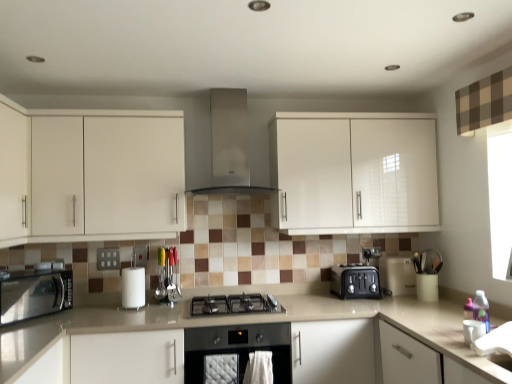
Question: Can you confirm if white glossy cabinet at upper left, the first cabinetry when ordered from left to right, is positioned to the right of black stainless steel microwave at lower left, which ranks as the second kitchen appliance in back-to-front order?

Choices:
 (A) no
 (B) yes

Answer: (B)

Question: Can you confirm if white glossy cabinet at upper left, the 2th cabinetry from the right, is bigger than black stainless steel microwave at lower left, the 1th kitchen appliance positioned from the front?

Choices:
 (A) yes
 (B) no

Answer: (A)

Question: Is the depth of white glossy cabinet at upper left, the first cabinetry when ordered from left to right, greater than that of black stainless steel microwave at lower left, the second kitchen appliance viewed from the right?

Choices:
 (A) yes
 (B) no

Answer: (A)

Question: Is white glossy cabinet at upper left, the first cabinetry when ordered from left to right, not near black stainless steel microwave at lower left, the second kitchen appliance viewed from the right?

Choices:
 (A) yes
 (B) no

Answer: (B)

Question: Would you say black stainless steel microwave at lower left, which ranks as the second kitchen appliance in back-to-front order, is part of white glossy cabinet at upper left, the 2th cabinetry from the right,'s contents?

Choices:
 (A) no
 (B) yes

Answer: (A)

Question: Would you say white glossy cabinet at upper left, the first cabinetry when ordered from left to right, is to the left or to the right of beige laminate countertop at center in the picture?

Choices:
 (A) left
 (B) right

Answer: (A)

Question: From a real-world perspective, is white glossy cabinet at upper left, the first cabinetry when ordered from left to right, positioned above or below beige laminate countertop at center?

Choices:
 (A) above
 (B) below

Answer: (A)

Question: Looking at the image, does white glossy cabinet at upper left, the first cabinetry when ordered from left to right, seem bigger or smaller compared to beige laminate countertop at center?

Choices:
 (A) big
 (B) small

Answer: (B)

Question: Is white glossy cabinet at upper left, the first cabinetry when ordered from left to right, taller or shorter than beige laminate countertop at center?

Choices:
 (A) tall
 (B) short

Answer: (A)

Question: Is black stainless steel microwave at lower left, the 1th kitchen appliance positioned from the front, in front of or behind white glossy cabinet at upper center, which is counted as the 2th cabinetry, starting from the left, in the image?

Choices:
 (A) behind
 (B) front

Answer: (B)

Question: Do you think black stainless steel microwave at lower left, the 1th kitchen appliance positioned from the front, is within white glossy cabinet at upper center, arranged as the 1th cabinetry when viewed from the right, or outside of it?

Choices:
 (A) outside
 (B) inside

Answer: (A)

Question: From their relative heights in the image, would you say black stainless steel microwave at lower left, which ranks as the 1th kitchen appliance in left-to-right order, is taller or shorter than white glossy cabinet at upper center, which is counted as the 2th cabinetry, starting from the left?

Choices:
 (A) short
 (B) tall

Answer: (A)

Question: Based on their sizes in the image, would you say black stainless steel microwave at lower left, which ranks as the 1th kitchen appliance in left-to-right order, is bigger or smaller than white glossy cabinet at upper center, arranged as the 1th cabinetry when viewed from the right?

Choices:
 (A) big
 (B) small

Answer: (B)

Question: From their relative heights in the image, would you say stainless steel oven at center, the second home appliance viewed from the top, is taller or shorter than beige laminate countertop at center?

Choices:
 (A) short
 (B) tall

Answer: (A)

Question: Considering the positions of stainless steel oven at center, the first home appliance ordered from the bottom, and beige laminate countertop at center in the image, is stainless steel oven at center, the first home appliance ordered from the bottom, bigger or smaller than beige laminate countertop at center?

Choices:
 (A) small
 (B) big

Answer: (A)